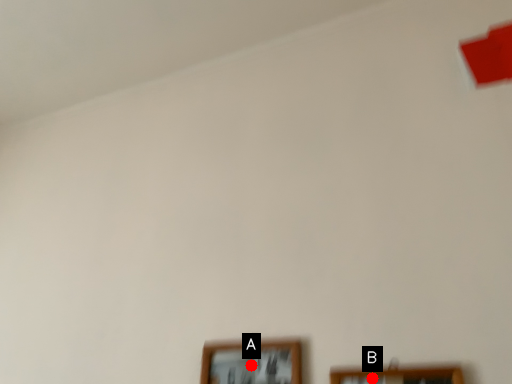
Question: Two points are circled on the image, labeled by A and B beside each circle. Which point appears closest to the camera in this image?

Choices:
 (A) A is closer
 (B) B is closer

Answer: (B)